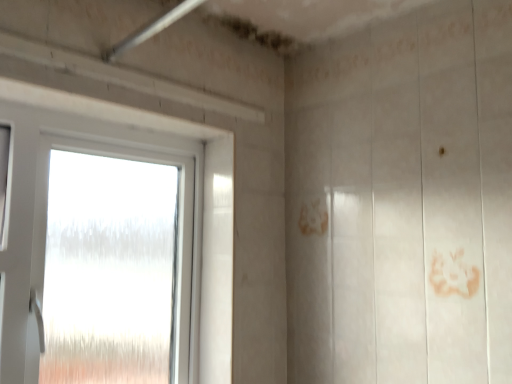
What is the approximate width of white plastic window at left?

white plastic window at left is 7.09 inches in width.

Describe the element at coordinates (114, 249) in the screenshot. I see `white plastic window at left` at that location.

Locate an element on the screen. white plastic window at left is located at coordinates (114, 249).

Locate an element on the screen. This screenshot has height=384, width=512. white plastic window at left is located at coordinates [114, 249].